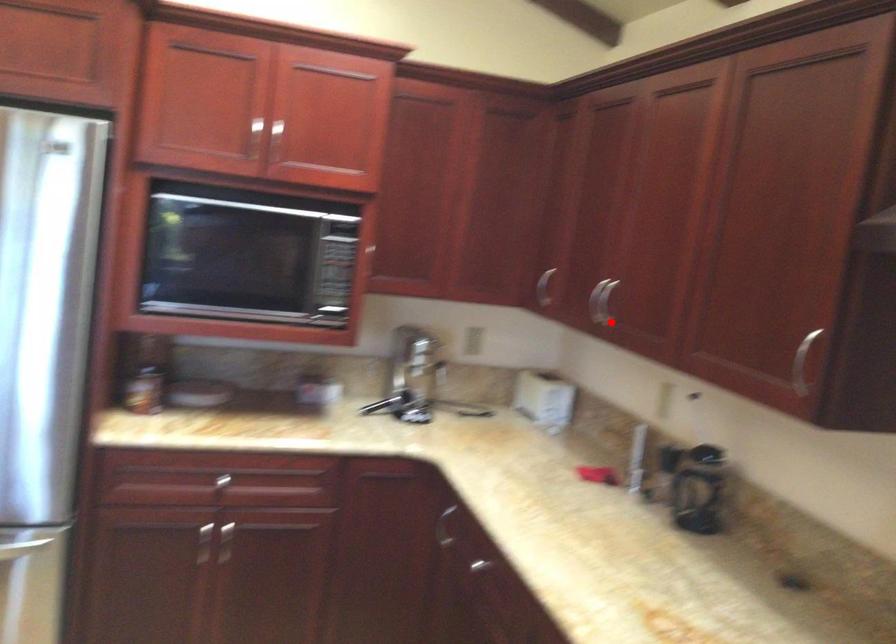
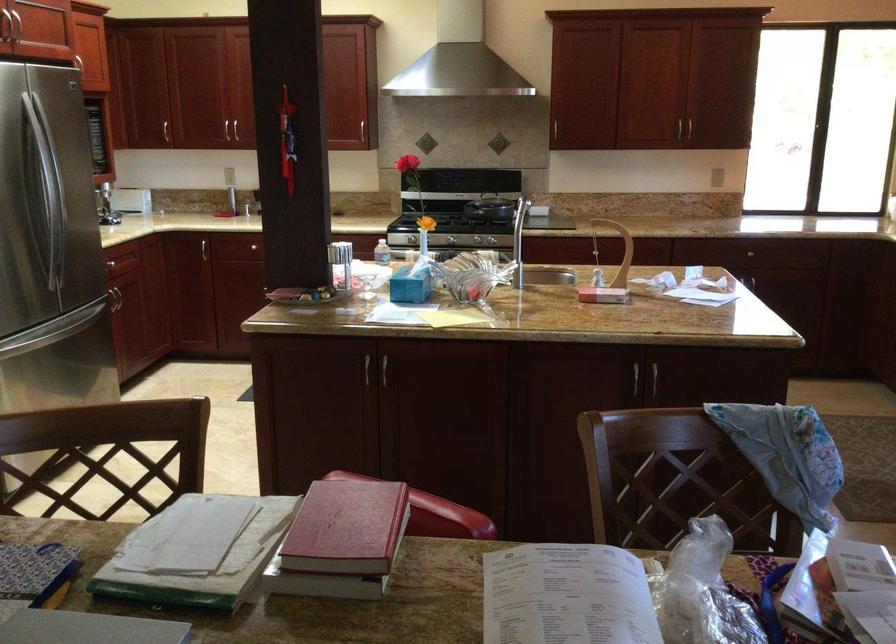
In the second image, find the point that corresponds to the highlighted location in the first image.

(165, 131)